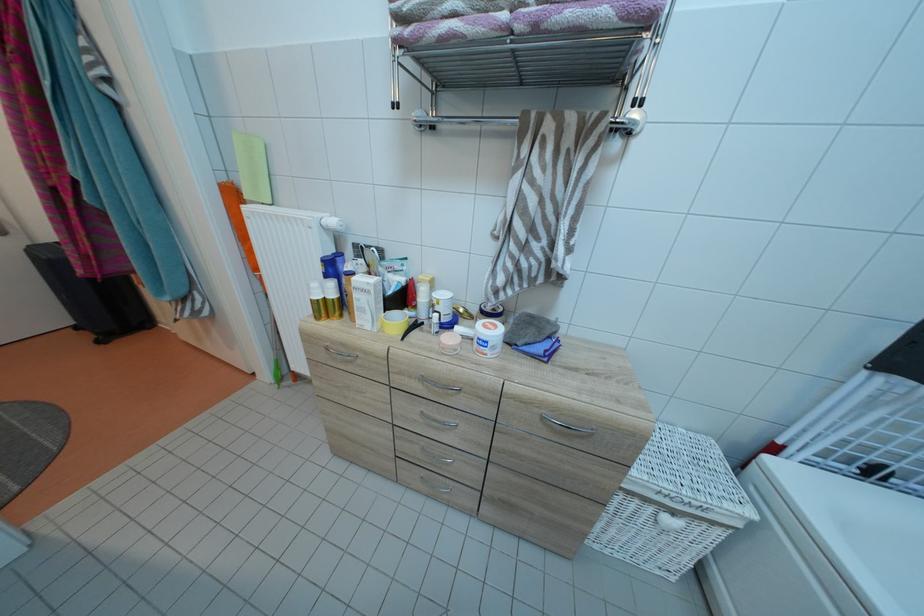
The image size is (924, 616). What do you see at coordinates (672, 505) in the screenshot?
I see `a white basket handle` at bounding box center [672, 505].